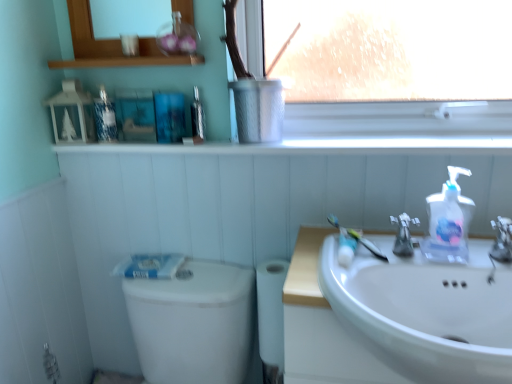
Where is `free location to the left of satin nickel faucet at sink right, the 2th tap viewed from the right`? The height and width of the screenshot is (384, 512). free location to the left of satin nickel faucet at sink right, the 2th tap viewed from the right is located at coordinates (351, 266).